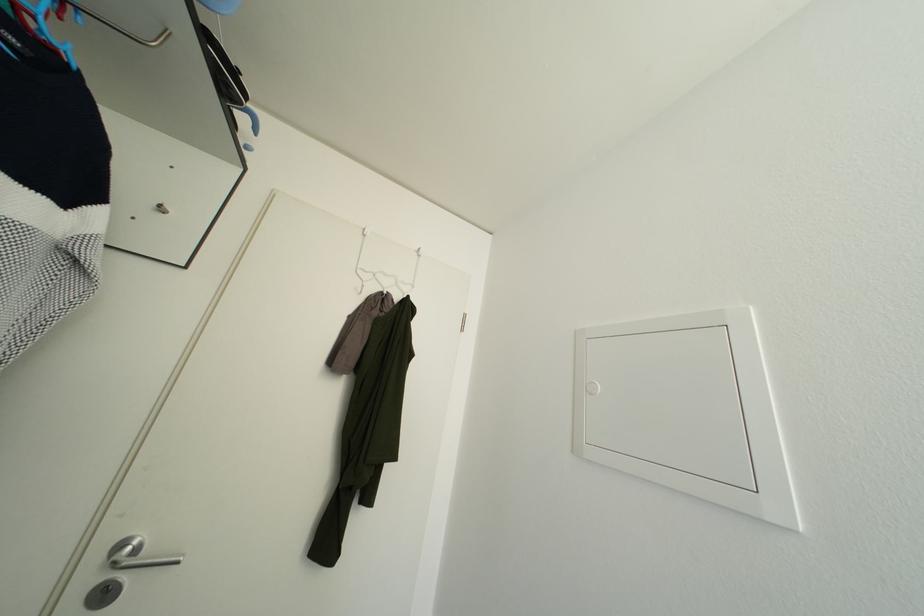
The image size is (924, 616). I want to click on white wire hanger, so click(x=383, y=273).